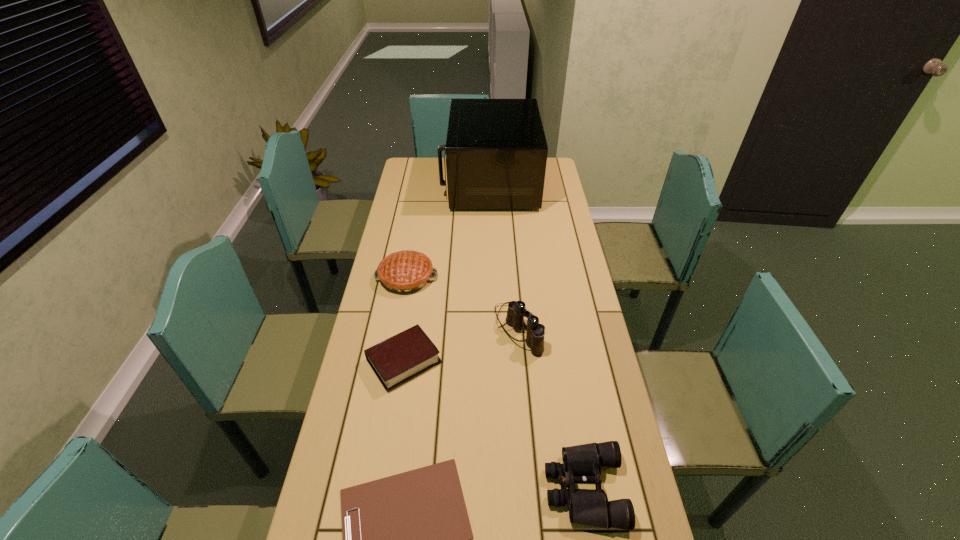
At what (x,y) coordinates should I click in order to perform the action: click on vacant space located on the front-facing side of the tallest object. Please return your answer as a coordinate pair (x, y). Looking at the image, I should click on (424, 183).

Image resolution: width=960 pixels, height=540 pixels. Find the location of `free space located 0.190m on the front-facing side of the tallest object`. free space located 0.190m on the front-facing side of the tallest object is located at coordinates (403, 183).

Where is `free location located 0.390m on the left of the second tallest object`? free location located 0.390m on the left of the second tallest object is located at coordinates (376, 329).

This screenshot has width=960, height=540. What are the coordinates of `free space located on the back of the pie` in the screenshot? It's located at (413, 244).

Image resolution: width=960 pixels, height=540 pixels. I want to click on free space located through the eyepieces of the nearer binoculars, so click(x=484, y=489).

Find the location of a particular element. The image size is (960, 540). free point located through the eyepieces of the nearer binoculars is located at coordinates (456, 489).

What are the coordinates of `vacant area situated through the eyepieces of the nearer binoculars` in the screenshot? It's located at (407, 489).

Locate an element on the screen. The image size is (960, 540). free spot located 0.140m on the front of the Bible is located at coordinates (393, 438).

Image resolution: width=960 pixels, height=540 pixels. I want to click on object that is at the far edge, so click(496, 151).

Locate an element on the screen. pie that is at the left edge is located at coordinates (406, 271).